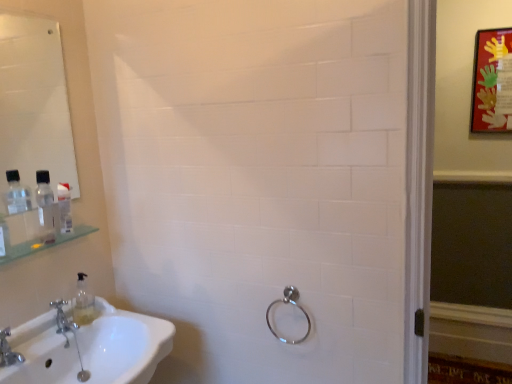
Question: Considering the relative sizes of white glossy sink at lower left and matte red picture frame at upper right in the image provided, is white glossy sink at lower left taller than matte red picture frame at upper right?

Choices:
 (A) yes
 (B) no

Answer: (B)

Question: Considering the relative positions of white glossy sink at lower left and matte red picture frame at upper right in the image provided, is white glossy sink at lower left to the left of matte red picture frame at upper right from the viewer's perspective?

Choices:
 (A) yes
 (B) no

Answer: (A)

Question: Is white glossy sink at lower left thinner than matte red picture frame at upper right?

Choices:
 (A) no
 (B) yes

Answer: (A)

Question: Is white glossy sink at lower left at the right side of matte red picture frame at upper right?

Choices:
 (A) yes
 (B) no

Answer: (B)

Question: Is white glossy sink at lower left aimed at matte red picture frame at upper right?

Choices:
 (A) no
 (B) yes

Answer: (A)

Question: Considering the positions of silver metallic faucet at lower left, which is the 2th tap from left to right, and clear plastic bottle at left in the image, is silver metallic faucet at lower left, which is the 2th tap from left to right, wider or thinner than clear plastic bottle at left?

Choices:
 (A) thin
 (B) wide

Answer: (A)

Question: Does point (56, 322) appear closer or farther from the camera than point (47, 173)?

Choices:
 (A) closer
 (B) farther

Answer: (A)

Question: Is silver metallic faucet at lower left, positioned as the 2th tap in front-to-back order, bigger or smaller than clear plastic bottle at left?

Choices:
 (A) small
 (B) big

Answer: (A)

Question: In the image, is silver metallic faucet at lower left, which is the 2th tap from left to right, on the left side or the right side of clear plastic bottle at left?

Choices:
 (A) left
 (B) right

Answer: (B)

Question: Considering the positions of white glossy sink at lower left and white glossy mirror at upper left in the image, is white glossy sink at lower left bigger or smaller than white glossy mirror at upper left?

Choices:
 (A) small
 (B) big

Answer: (B)

Question: In the image, is white glossy sink at lower left on the left side or the right side of white glossy mirror at upper left?

Choices:
 (A) left
 (B) right

Answer: (B)

Question: From a real-world perspective, relative to white glossy mirror at upper left, is white glossy sink at lower left vertically above or below?

Choices:
 (A) above
 (B) below

Answer: (B)

Question: Is white glossy sink at lower left wider or thinner than white glossy mirror at upper left?

Choices:
 (A) wide
 (B) thin

Answer: (A)

Question: From a real-world perspective, relative to brushed metal faucet at lower left, acting as the 2th tap starting from the back, is white glossy mirror at upper left vertically above or below?

Choices:
 (A) below
 (B) above

Answer: (B)

Question: From the image's perspective, relative to brushed metal faucet at lower left, which is the second tap from right to left, is white glossy mirror at upper left above or below?

Choices:
 (A) below
 (B) above

Answer: (B)